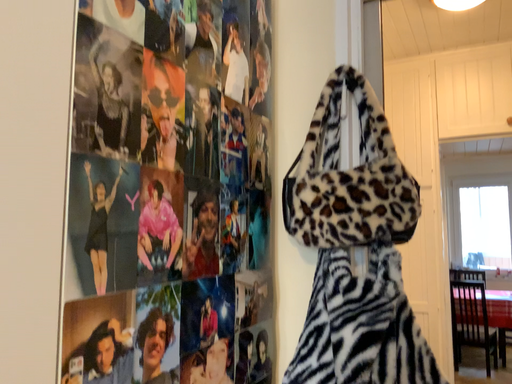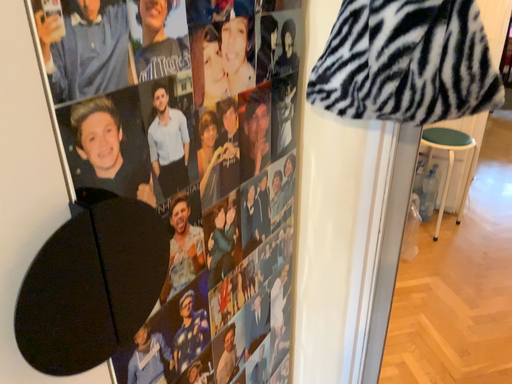
Question: How did the camera likely rotate when shooting the video?

Choices:
 (A) rotated downward
 (B) rotated upward

Answer: (A)